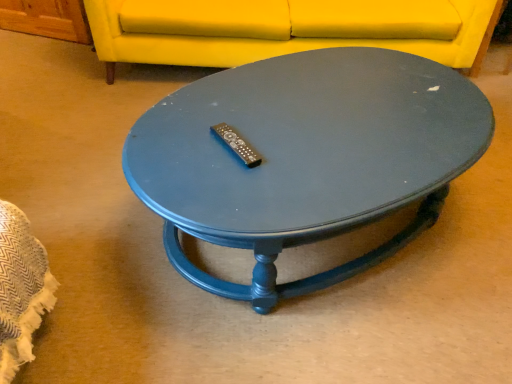
In order to face matte blue coffee table at center, should I rotate leftwards or rightwards?

It's best to rotate right around 7.736 degrees.

Identify the location of matte blue coffee table at center. (304, 157).

What do you see at coordinates (304, 157) in the screenshot?
I see `matte blue coffee table at center` at bounding box center [304, 157].

What is the approximate width of matte yellow fabric couch at upper center?

37.74 inches.

This screenshot has height=384, width=512. Find the location of `matte yellow fabric couch at upper center`. matte yellow fabric couch at upper center is located at coordinates (286, 29).

Describe the element at coordinates (286, 29) in the screenshot. I see `matte yellow fabric couch at upper center` at that location.

Locate an element on the screen. matte blue coffee table at center is located at coordinates (304, 157).

From the picture: Which is more to the left, matte yellow fabric couch at upper center or matte blue coffee table at center?

Positioned to the left is matte yellow fabric couch at upper center.

Which object is further away from the camera, matte yellow fabric couch at upper center or matte blue coffee table at center?

matte yellow fabric couch at upper center is further from the camera.

Which is nearer, (176, 38) or (434, 121)?

The point (434, 121) is closer.

From the image's perspective, which is above, matte yellow fabric couch at upper center or matte blue coffee table at center?

From the image's view, matte yellow fabric couch at upper center is above.

From a real-world perspective, between matte yellow fabric couch at upper center and matte blue coffee table at center, who is vertically lower?

matte blue coffee table at center.

Between matte yellow fabric couch at upper center and matte blue coffee table at center, which one has larger width?

matte yellow fabric couch at upper center is wider.

Is matte yellow fabric couch at upper center taller than matte blue coffee table at center?

Indeed, matte yellow fabric couch at upper center has a greater height compared to matte blue coffee table at center.

Which of these two, matte yellow fabric couch at upper center or matte blue coffee table at center, is bigger?

matte yellow fabric couch at upper center.

Can we say matte yellow fabric couch at upper center lies outside matte blue coffee table at center?

That's correct, matte yellow fabric couch at upper center is outside of matte blue coffee table at center.

Are matte yellow fabric couch at upper center and matte blue coffee table at center making contact?

No, matte yellow fabric couch at upper center is not next to matte blue coffee table at center.

Is matte yellow fabric couch at upper center facing towards matte blue coffee table at center?

Yes, matte yellow fabric couch at upper center is aimed at matte blue coffee table at center.

In the image, there is a matte blue coffee table at center. Where is `studio couch above it (from the image's perspective)`? studio couch above it (from the image's perspective) is located at coordinates (286, 29).

Which is more to the left, matte blue coffee table at center or matte yellow fabric couch at upper center?

Positioned to the left is matte yellow fabric couch at upper center.

Is matte blue coffee table at center further to the viewer compared to matte yellow fabric couch at upper center?

No, it is in front of matte yellow fabric couch at upper center.

Which is closer to the camera, (371, 89) or (407, 30)?

Point (371, 89).

From the image's perspective, is matte blue coffee table at center below matte yellow fabric couch at upper center?

Correct, matte blue coffee table at center appears lower than matte yellow fabric couch at upper center in the image.

From a real-world perspective, is matte blue coffee table at center above or below matte yellow fabric couch at upper center?

In terms of real-world spatial position, matte blue coffee table at center is below matte yellow fabric couch at upper center.

Which object is wider, matte blue coffee table at center or matte yellow fabric couch at upper center?

With larger width is matte yellow fabric couch at upper center.

Is matte blue coffee table at center taller or shorter than matte yellow fabric couch at upper center?

Considering their sizes, matte blue coffee table at center has less height than matte yellow fabric couch at upper center.

Who is smaller, matte blue coffee table at center or matte yellow fabric couch at upper center?

With smaller size is matte blue coffee table at center.

In the scene shown: Is matte blue coffee table at center outside of matte yellow fabric couch at upper center?

Yes, matte blue coffee table at center is outside of matte yellow fabric couch at upper center.

Can you see matte blue coffee table at center touching matte yellow fabric couch at upper center?

No, matte blue coffee table at center is not in contact with matte yellow fabric couch at upper center.

Is matte blue coffee table at center turned away from matte yellow fabric couch at upper center?

Answer: Yes, matte yellow fabric couch at upper center is at the back of matte blue coffee table at center.

What's the angular difference between matte blue coffee table at center and matte yellow fabric couch at upper center's facing directions?

The facing directions of matte blue coffee table at center and matte yellow fabric couch at upper center are 32.2 degrees apart.

Measure the distance from matte blue coffee table at center to matte yellow fabric couch at upper center.

They are 35.95 inches apart.

Where is `studio couch above the matte blue coffee table at center (from the image's perspective)`? This screenshot has height=384, width=512. studio couch above the matte blue coffee table at center (from the image's perspective) is located at coordinates (286, 29).

At what (x,y) coordinates should I click in order to perform the action: click on studio couch above the matte blue coffee table at center (from a real-world perspective). Please return your answer as a coordinate pair (x, y). The height and width of the screenshot is (384, 512). Looking at the image, I should click on (286, 29).

Where is `studio couch on the left of matte blue coffee table at center`? Image resolution: width=512 pixels, height=384 pixels. studio couch on the left of matte blue coffee table at center is located at coordinates (286, 29).